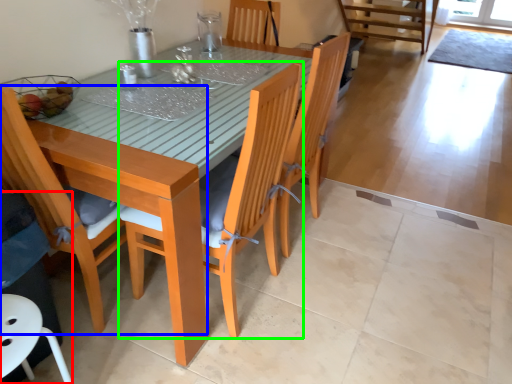
Question: Estimate the real-world distances between objects in this image. Which object is closer to swivel chair (highlighted by a red box), chair (highlighted by a blue box) or chair (highlighted by a green box)?

Choices:
 (A) chair
 (B) chair

Answer: (A)